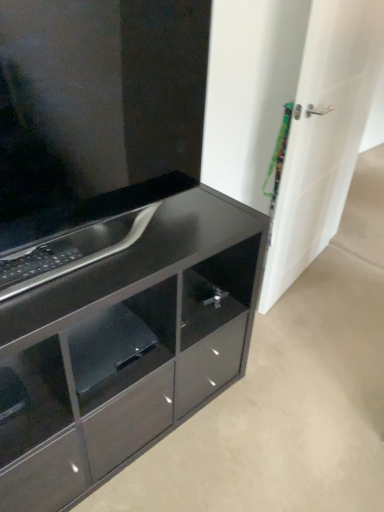
Identify the location of free point below white glossy door at right (from a real-world perspective). (302, 274).